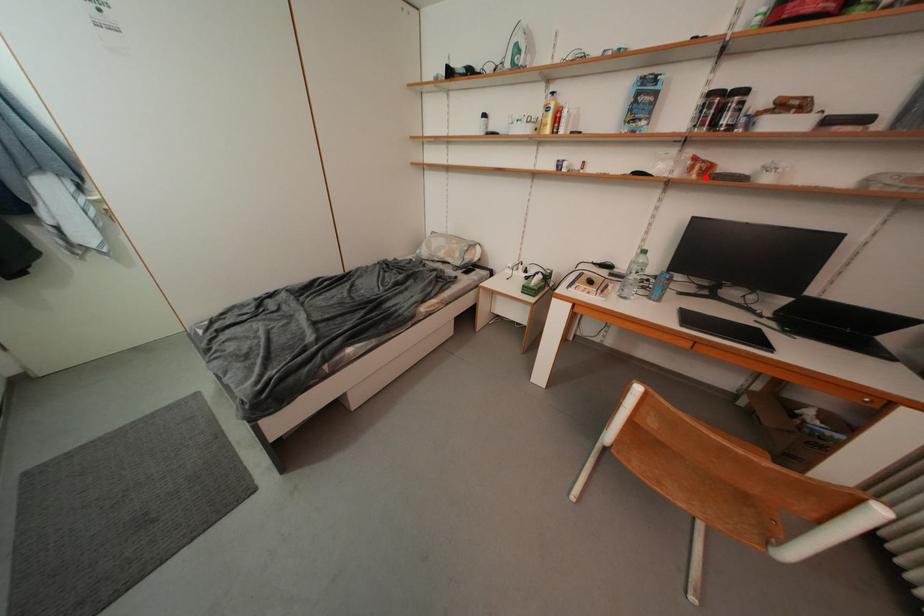
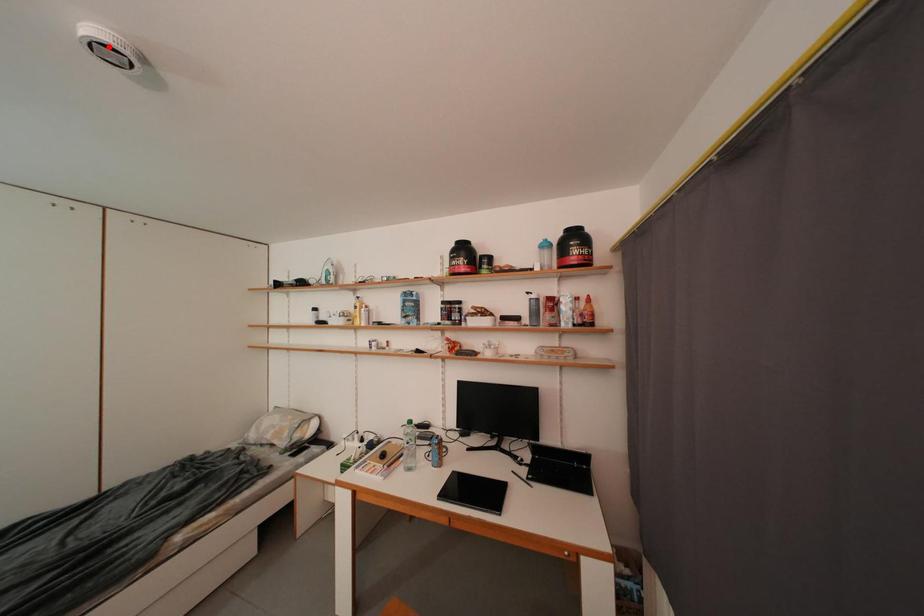
I am providing you with two images of the same scene from different viewpoints. A red point is marked on the first image and another point is marked on the second image. Is the red point in image1 aligned with the point shown in image2?

No